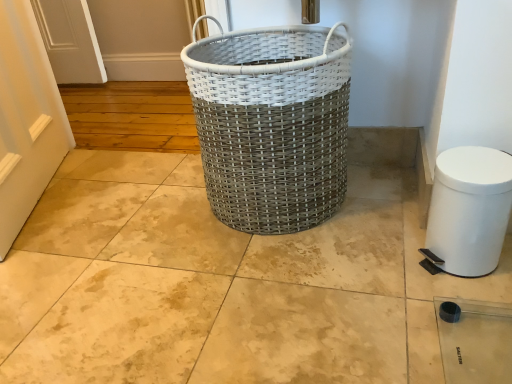
Find the location of `vacant area that lies between white woven basket at center and white plastic trash can at lower right`. vacant area that lies between white woven basket at center and white plastic trash can at lower right is located at coordinates (366, 228).